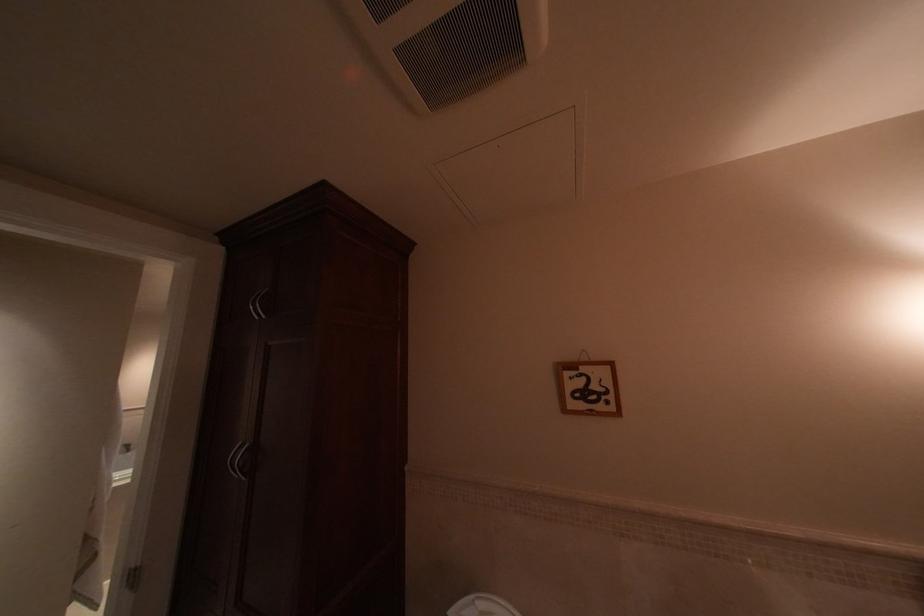
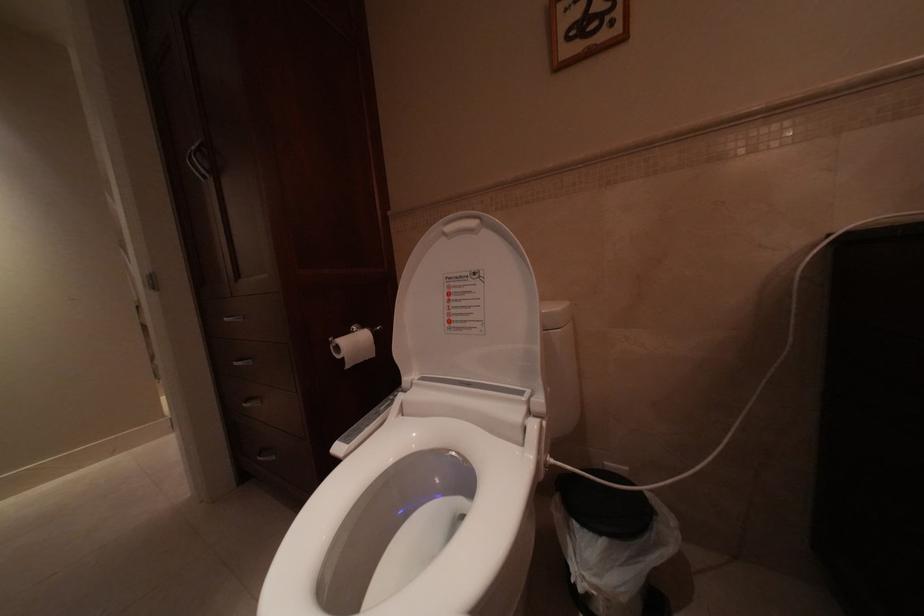
Question: In a continuous first-person perspective shot, in which direction is the camera moving?

Choices:
 (A) Left
 (B) Right
 (C) Forward
 (D) Backward

Answer: (B)